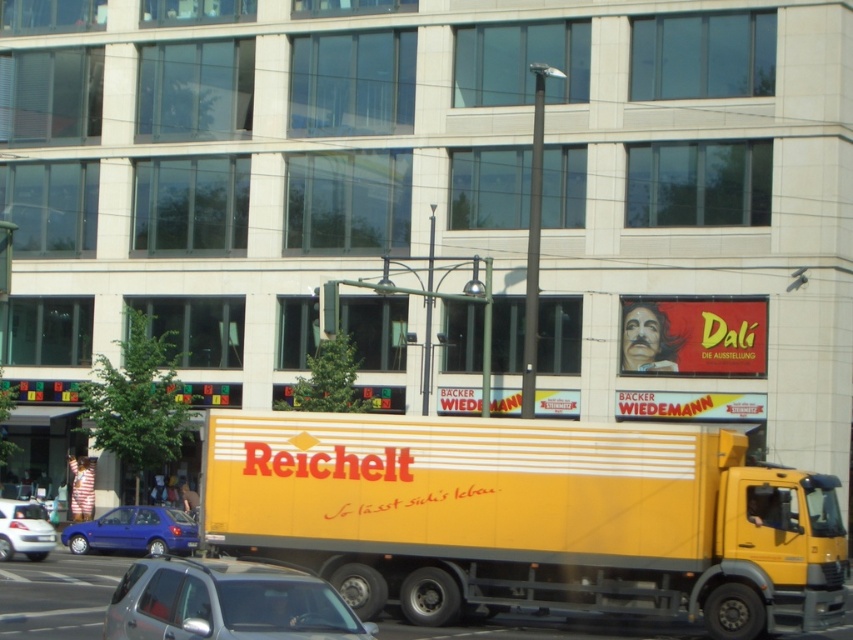
Does yellow matte truck at center appear on the right side of white glossy car at lower left?

Correct, you'll find yellow matte truck at center to the right of white glossy car at lower left.

Which is more to the right, yellow matte truck at center or white glossy car at lower left?

yellow matte truck at center

Is point (299, 554) positioned behind point (35, 548)?

No, it is in front of (35, 548).

Identify the location of yellow matte truck at center. The height and width of the screenshot is (640, 853). (529, 516).

Does metallic blue hatchback at lower left appear on the left side of white glossy car at lower left?

Incorrect, metallic blue hatchback at lower left is not on the left side of white glossy car at lower left.

Who is more forward, [155,528] or [19,531]?

Point [19,531] is more forward.

Where is `metallic blue hatchback at lower left`? The width and height of the screenshot is (853, 640). metallic blue hatchback at lower left is located at coordinates (134, 531).

Describe the element at coordinates (529, 516) in the screenshot. The image size is (853, 640). I see `yellow matte truck at center` at that location.

Does yellow matte truck at center appear under metallic blue hatchback at lower left?

Actually, yellow matte truck at center is above metallic blue hatchback at lower left.

Identify the location of yellow matte truck at center. This screenshot has height=640, width=853. (529, 516).

Locate an element on the screen. yellow matte truck at center is located at coordinates (529, 516).